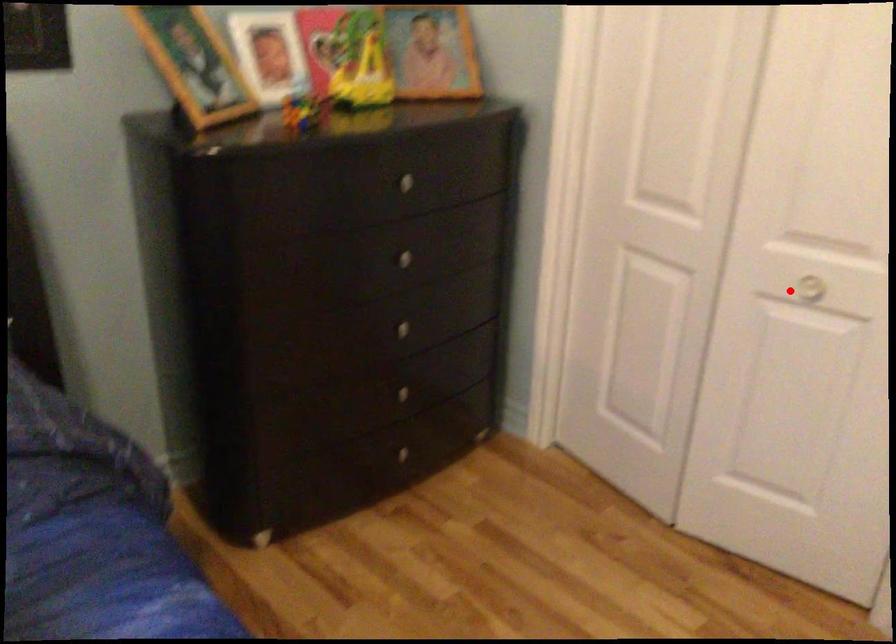
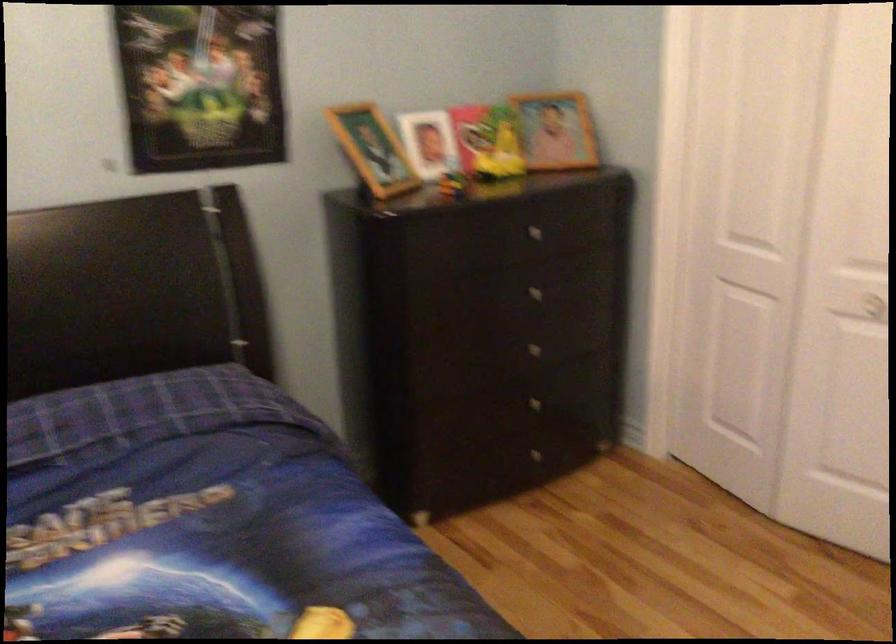
Locate, in the second image, the point that corresponds to the highlighted location in the first image.

(864, 305)